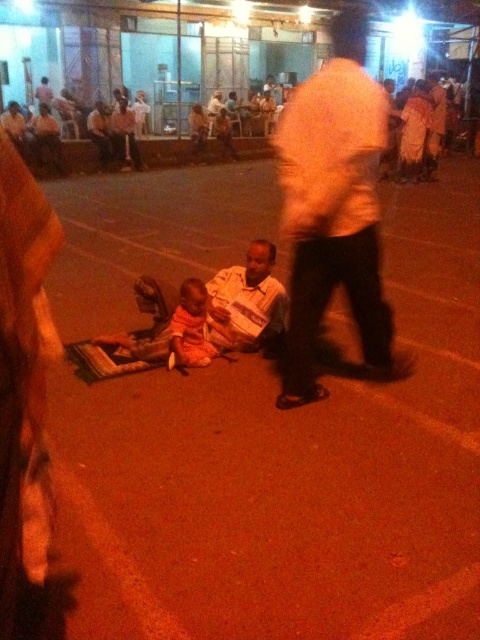
Question: Estimate the real-world distances between objects in this image. Which object is closer to the white striped shirt at center?

Choices:
 (A) white matte shirt at center
 (B) orange cotton baby at center

Answer: (B)

Question: Is white matte shirt at center above orange cotton baby at center?

Choices:
 (A) no
 (B) yes

Answer: (B)

Question: Among these objects, which one is nearest to the camera?

Choices:
 (A) white matte shirt at center
 (B) orange cotton baby at center
 (C) white striped shirt at center

Answer: (A)

Question: Is white striped shirt at center below orange cotton baby at center?

Choices:
 (A) yes
 (B) no

Answer: (B)

Question: Which of the following is the farthest from the observer?

Choices:
 (A) (216, 353)
 (B) (228, 268)
 (C) (337, 19)

Answer: (B)

Question: Does white matte shirt at center lie in front of orange cotton baby at center?

Choices:
 (A) yes
 (B) no

Answer: (A)